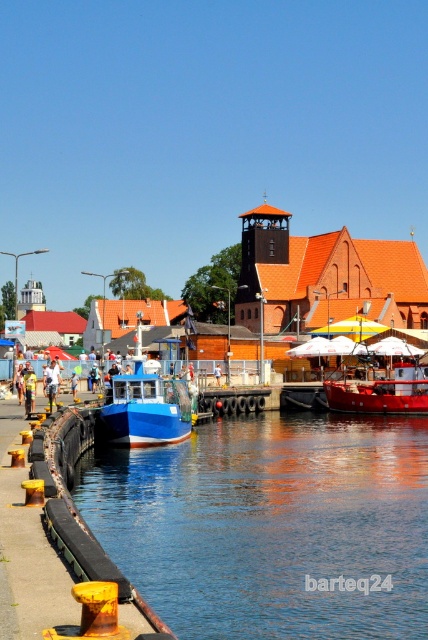
Question: Which of the following is the farthest from the observer?

Choices:
 (A) (214, 376)
 (B) (333, 422)
 (C) (356, 401)
 (D) (32, 410)

Answer: (A)

Question: Is blue matte boat at center bigger than blue fabric umbrella at center?

Choices:
 (A) no
 (B) yes

Answer: (B)

Question: In this image, where is blue fabric umbrella at center located relative to yellow reflective vest at center?

Choices:
 (A) right
 (B) left

Answer: (A)

Question: Which object is positioned farthest from the blue fabric umbrella at center?

Choices:
 (A) blue water at lower left
 (B) red matte boat at center
 (C) yellow reflective vest at center

Answer: (B)

Question: Estimate the real-world distances between objects in this image. Which object is closer to the yellow reflective vest at center?

Choices:
 (A) blue fabric umbrella at center
 (B) white fabric umbrella at upper center
 (C) blue matte boat at center

Answer: (A)

Question: Is blue water at lower left behind yellow reflective vest at center?

Choices:
 (A) yes
 (B) no

Answer: (B)